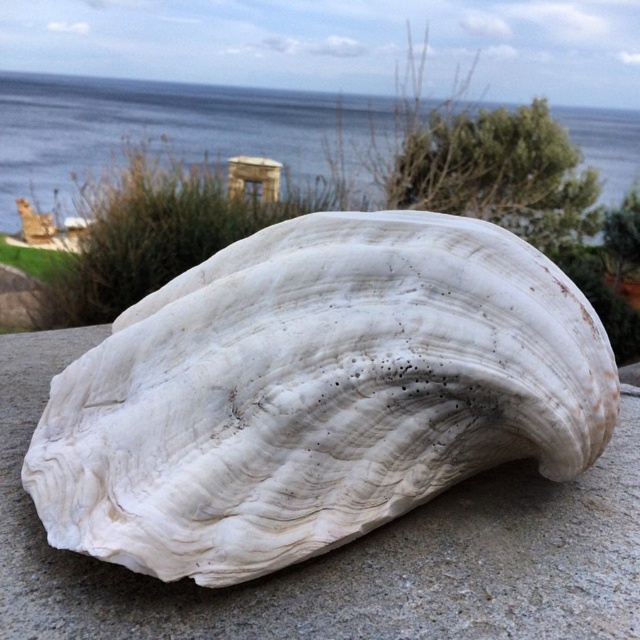
Is white marble shell at center smaller than blue water at upper center?

No, white marble shell at center is not smaller than blue water at upper center.

Who is positioned more to the right, white marble shell at center or blue water at upper center?

Positioned to the right is white marble shell at center.

From the picture: Who is more forward, [314,355] or [154,125]?

Point [314,355] is in front.

You are a GUI agent. You are given a task and a screenshot of the screen. Output one action in this format:
    pyautogui.click(x=<x>, y=<y>)
    Task: Click on the white marble shell at center
    
    Given the screenshot: What is the action you would take?
    pyautogui.click(x=316, y=394)